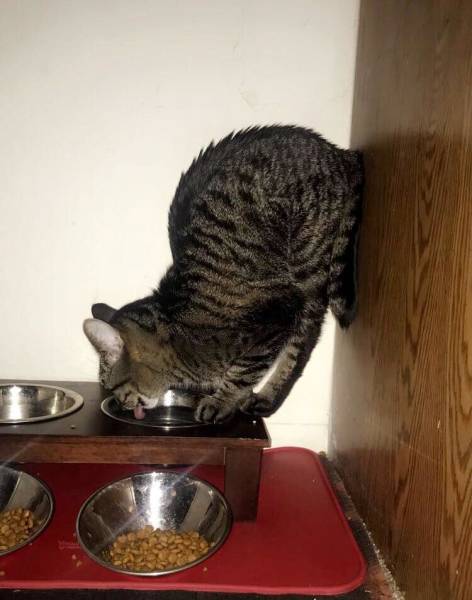
Identify the location of cat food & water station. (221, 441), (27, 446).